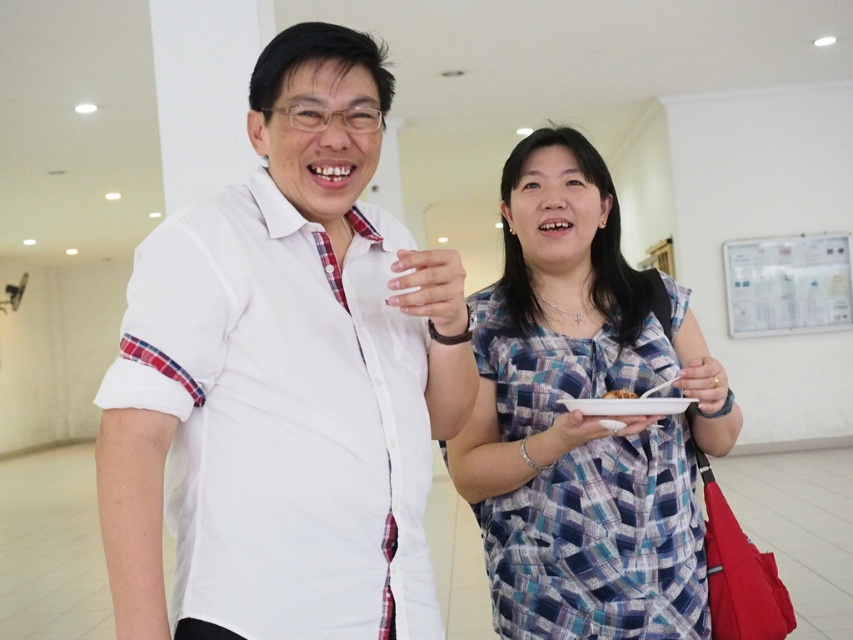
You are a server in a restaurant and need to serve two customers. You have a white matte plate at center and a smooth white plate at center. Which plate should you choose if you want to serve a larger portion of food?

The white matte plate at center has a larger size compared to the smooth white plate at center, so you should choose the white matte plate at center to serve a larger portion of food.

You are a photographer setting up a shot in this scene. You need to ensure that the blue plaid dress at center and the white matte plate at center are both in focus. Given that your camera can only focus on objects within a 10cm depth range, can you confirm if both objects are within this range based on their sizes?

The blue plaid dress at center is bigger than the white matte plate at center. Since size does not necessarily indicate distance, we cannot confirm if both are within the 10cm depth range based solely on their sizes.

You are a food delivery person who needs to place a white matte plate at center and a smooth white plate at center on a small shelf. The shelf has limited vertical space. Which plate should you place on top to ensure both fit vertically?

The white matte plate at center is below the smooth white plate at center, so to fit both vertically on the shelf, place the smooth white plate at center on top of the white matte plate at center.